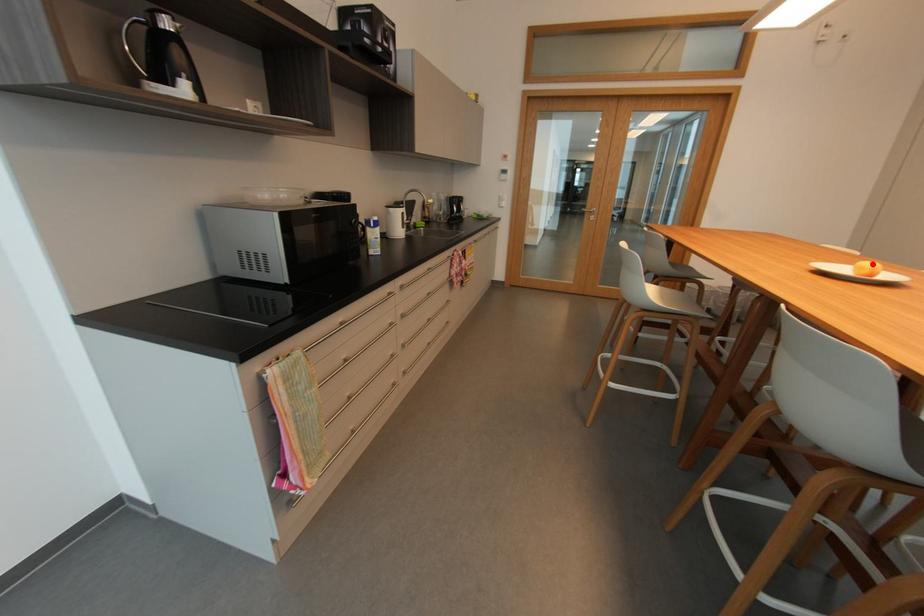
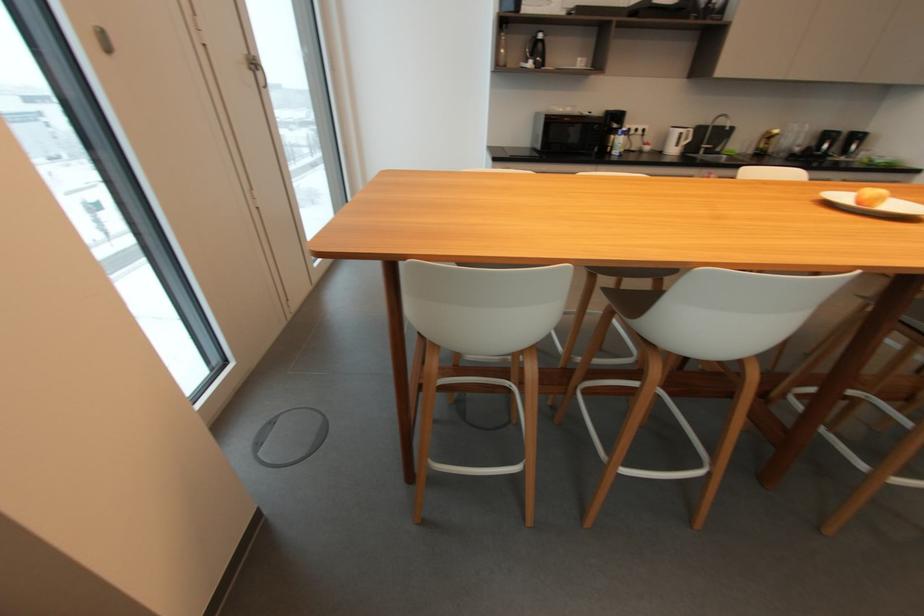
Locate, in the second image, the point that corresponds to the highlighted location in the first image.

(881, 191)